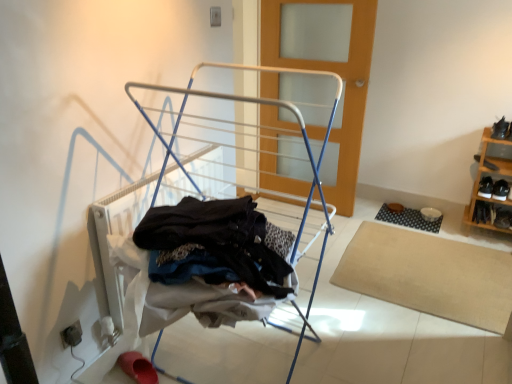
The width and height of the screenshot is (512, 384). Describe the element at coordinates (327, 70) in the screenshot. I see `wooden door at center` at that location.

What is the approximate height of wooden door at center?

It is 1.45 meters.

The height and width of the screenshot is (384, 512). In order to click on black leather shoe at lower right, positioned as the 1th shoe in bottom-to-top order in this screenshot , I will do `click(503, 219)`.

At what (x,y) coordinates should I click in order to perform the action: click on black leather shoe at right, arranged as the second shoe when viewed from the top. Please return your answer as a coordinate pair (x, y). This screenshot has height=384, width=512. Looking at the image, I should click on (490, 165).

The width and height of the screenshot is (512, 384). What do you see at coordinates (490, 165) in the screenshot?
I see `black leather shoe at right, acting as the fourth shoe starting from the bottom` at bounding box center [490, 165].

The height and width of the screenshot is (384, 512). What do you see at coordinates (138, 367) in the screenshot?
I see `rubber shoe at lower left, the first footwear positioned from the front` at bounding box center [138, 367].

Find the location of a particular element. The image size is (512, 384). wooden door at center is located at coordinates (327, 70).

Can you confirm if wooden shoe rack at right is shorter than black leather shoe at lower right, the 5th shoe in the top-to-bottom sequence?

Incorrect, the height of wooden shoe rack at right does not fall short of that of black leather shoe at lower right, the 5th shoe in the top-to-bottom sequence.

Where is `furniture above the black leather shoe at lower right, positioned as the 1th shoe in bottom-to-top order (from the image's perspective)`? Image resolution: width=512 pixels, height=384 pixels. furniture above the black leather shoe at lower right, positioned as the 1th shoe in bottom-to-top order (from the image's perspective) is located at coordinates (490, 175).

Is wooden shoe rack at right far from black leather shoe at lower right, the 5th shoe in the top-to-bottom sequence?

No, wooden shoe rack at right is not far away from black leather shoe at lower right, the 5th shoe in the top-to-bottom sequence.

From the image's perspective, is wooden shoe rack at right below black leather shoe at lower right, the 5th shoe in the top-to-bottom sequence?

Actually, wooden shoe rack at right appears above black leather shoe at lower right, the 5th shoe in the top-to-bottom sequence, in the image.

Which of these two, rubber shoe at lower left, which is the second footwear from right to left, or white metal drying rack at center, is smaller?

rubber shoe at lower left, which is the second footwear from right to left.

Which of these two, rubber shoe at lower left, the second footwear positioned from the back, or white metal drying rack at center, is wider?

With larger width is white metal drying rack at center.

Are rubber shoe at lower left, the first footwear positioned from the front, and white metal drying rack at center beside each other?

No, rubber shoe at lower left, the first footwear positioned from the front, is not in contact with white metal drying rack at center.

Is rubber shoe at lower left, arranged as the 1th footwear when ordered from the bottom, turned away from white metal drying rack at center?

Absolutely, rubber shoe at lower left, arranged as the 1th footwear when ordered from the bottom, is directed away from white metal drying rack at center.

This screenshot has height=384, width=512. Identify the location of mat behind the black leather shoes at lower right, which is counted as the 1th footwear, starting from the top. (408, 219).

Is black leather shoes at lower right, the 1th footwear positioned from the back, spatially inside black rubber mat at lower right, which ranks as the second mat in front-to-back order, or outside of it?

black leather shoes at lower right, the 1th footwear positioned from the back, is not enclosed by black rubber mat at lower right, which ranks as the second mat in front-to-back order.

Is black leather shoes at lower right, the 1th footwear positioned from the back, smaller than black rubber mat at lower right, which is counted as the 1th mat, starting from the back?

No, black leather shoes at lower right, the 1th footwear positioned from the back, is not smaller than black rubber mat at lower right, which is counted as the 1th mat, starting from the back.

Can you tell me how much black leather shoes at lower right, the 2th footwear in the front-to-back sequence, and black rubber mat at lower right, which ranks as the second mat in front-to-back order, differ in facing direction?

The angular difference between black leather shoes at lower right, the 2th footwear in the front-to-back sequence, and black rubber mat at lower right, which ranks as the second mat in front-to-back order, is 1.15 degrees.

Can you confirm if rubber shoe at lower left, placed as the second footwear when sorted from top to bottom, is positioned to the right of black leather shoe at upper right, positioned as the fifth shoe in bottom-to-top order?

Incorrect, rubber shoe at lower left, placed as the second footwear when sorted from top to bottom, is not on the right side of black leather shoe at upper right, positioned as the fifth shoe in bottom-to-top order.

Consider the image. Is black leather shoe at upper right, positioned as the fifth shoe in bottom-to-top order, surrounded by rubber shoe at lower left, the first footwear positioned from the front?

No, black leather shoe at upper right, positioned as the fifth shoe in bottom-to-top order, is located outside of rubber shoe at lower left, the first footwear positioned from the front.

Considering the relative sizes of rubber shoe at lower left, placed as the second footwear when sorted from top to bottom, and black leather shoe at upper right, positioned as the fifth shoe in bottom-to-top order, in the image provided, is rubber shoe at lower left, placed as the second footwear when sorted from top to bottom, bigger than black leather shoe at upper right, positioned as the fifth shoe in bottom-to-top order,?

No, rubber shoe at lower left, placed as the second footwear when sorted from top to bottom, is not bigger than black leather shoe at upper right, positioned as the fifth shoe in bottom-to-top order.

The height and width of the screenshot is (384, 512). Find the location of `footwear that is the 2nd object located below the black leather shoe at upper right, arranged as the first shoe when viewed from the top (from the image's perspective)`. footwear that is the 2nd object located below the black leather shoe at upper right, arranged as the first shoe when viewed from the top (from the image's perspective) is located at coordinates (138, 367).

Can you confirm if beige carpet at lower right, which appears as the 2th mat when viewed from the back, is wider than white metal drying rack at center?

Correct, the width of beige carpet at lower right, which appears as the 2th mat when viewed from the back, exceeds that of white metal drying rack at center.

Who is bigger, beige carpet at lower right, arranged as the second mat when viewed from the top, or white metal drying rack at center?

With larger size is white metal drying rack at center.

How many degrees apart are the facing directions of beige carpet at lower right, the first mat from the front, and white metal drying rack at center?

The angular difference between beige carpet at lower right, the first mat from the front, and white metal drying rack at center is 89.1 degrees.

Visually, is beige carpet at lower right, which appears as the 2th mat when viewed from the back, positioned to the left or to the right of white metal drying rack at center?

In the image, beige carpet at lower right, which appears as the 2th mat when viewed from the back, appears on the right side of white metal drying rack at center.

Would you say wooden shoe rack at right is a long distance from black rubber mat at lower right, which ranks as the second mat in front-to-back order?

They are positioned close to each other.

Does wooden shoe rack at right have a larger size compared to black rubber mat at lower right, which ranks as the second mat in front-to-back order?

Correct, wooden shoe rack at right is larger in size than black rubber mat at lower right, which ranks as the second mat in front-to-back order.

Which is more to the right, wooden shoe rack at right or black rubber mat at lower right, which is counted as the 1th mat, starting from the back?

From the viewer's perspective, wooden shoe rack at right appears more on the right side.

Is point (499, 144) closer or farther from the camera than point (381, 207)?

Point (499, 144).

Which is more to the right, black leather shoe at lower right, placed as the second shoe when sorted from bottom to top, or black leather shoe at right, arranged as the second shoe when viewed from the top?

black leather shoe at lower right, placed as the second shoe when sorted from bottom to top.

Based on the photo, from a real-world perspective, is black leather shoe at lower right, placed as the second shoe when sorted from bottom to top, physically above black leather shoe at right, acting as the fourth shoe starting from the bottom?

Incorrect, from a real-world perspective, black leather shoe at lower right, placed as the second shoe when sorted from bottom to top, is lower than black leather shoe at right, acting as the fourth shoe starting from the bottom.

Does black leather shoe at lower right, placed as the second shoe when sorted from bottom to top, have a lesser height compared to black leather shoe at right, arranged as the second shoe when viewed from the top?

In fact, black leather shoe at lower right, placed as the second shoe when sorted from bottom to top, may be taller than black leather shoe at right, arranged as the second shoe when viewed from the top.

Is black leather shoe at lower right, placed as the second shoe when sorted from bottom to top, in front of or behind black leather shoe at right, acting as the fourth shoe starting from the bottom, in the image?

black leather shoe at lower right, placed as the second shoe when sorted from bottom to top, is behind black leather shoe at right, acting as the fourth shoe starting from the bottom.

Identify the location of furniture above the black leather shoe at lower right, positioned as the 1th shoe in bottom-to-top order (from a real-world perspective). (490, 175).

Locate an element on the screen. This screenshot has width=512, height=384. footwear that is the 2nd one below the white metal drying rack at center (from a real-world perspective) is located at coordinates (138, 367).

Estimate the real-world distances between objects in this image. Which object is further from black leather shoe at lower right, placed as the second shoe when sorted from bottom to top, black leather shoe at upper right, positioned as the fifth shoe in bottom-to-top order, or white metal drying rack at center?

The object further to black leather shoe at lower right, placed as the second shoe when sorted from bottom to top, is white metal drying rack at center.

Looking at the image, which one is located further to white metal drying rack at center, black leather shoes at lower right, placed as the second footwear when sorted from left to right, or black leather shoe at upper right, arranged as the first shoe when viewed from the top?

black leather shoe at upper right, arranged as the first shoe when viewed from the top, lies further to white metal drying rack at center than the other object.

Considering their positions, is black leather shoe at lower right, the 5th shoe in the top-to-bottom sequence, positioned closer to black leather shoes at lower right, the 2th footwear in the front-to-back sequence, than black leather shoe at lower right, which ranks as the 3th shoe in bottom-to-top order?

black leather shoe at lower right, which ranks as the 3th shoe in bottom-to-top order.

Based on their spatial positions, is black leather shoes at lower right, the 1th footwear positioned from the back, or black leather shoe at lower right, placed as the second shoe when sorted from bottom to top, further from rubber shoe at lower left, marked as the first footwear in a left-to-right arrangement?

black leather shoe at lower right, placed as the second shoe when sorted from bottom to top.

Which object lies further to the anchor point black rubber mat at lower right, the first mat when ordered from top to bottom, black leather shoe at right, arranged as the second shoe when viewed from the top, or wooden door at center?

wooden door at center is positioned further to the anchor black rubber mat at lower right, the first mat when ordered from top to bottom.

From the image, which object appears to be farther from black leather shoe at lower right, placed as the 4th shoe when sorted from top to bottom, black leather shoe at right, acting as the fourth shoe starting from the bottom, or black leather shoes at lower right, which is counted as the first footwear, starting from the right?

Among the two, black leather shoe at right, acting as the fourth shoe starting from the bottom, is located further to black leather shoe at lower right, placed as the 4th shoe when sorted from top to bottom.

Estimate the real-world distances between objects in this image. Which object is further from black leather shoes at lower right, which is counted as the 1th footwear, starting from the top, black leather shoe at right, acting as the fourth shoe starting from the bottom, or black rubber mat at lower right, which ranks as the second mat in front-to-back order?

black rubber mat at lower right, which ranks as the second mat in front-to-back order.

Consider the image. From the image, which object appears to be nearer to black leather shoes at lower right, the 2th footwear ordered from the bottom, black leather shoe at lower right, which ranks as the 3th shoe in bottom-to-top order, or rubber shoe at lower left, which is the second footwear from right to left?

black leather shoe at lower right, which ranks as the 3th shoe in bottom-to-top order, lies closer to black leather shoes at lower right, the 2th footwear ordered from the bottom, than the other object.

Locate an element on the screen. Image resolution: width=512 pixels, height=384 pixels. shoe between black leather shoes at lower right, the 2th footwear in the front-to-back sequence, and black leather shoe at lower right, placed as the 4th shoe when sorted from top to bottom, in the up-down direction is located at coordinates (478, 212).

Locate an element on the screen. furniture between black leather shoe at upper right, positioned as the fifth shoe in bottom-to-top order, and black leather shoes at lower right, placed as the second footwear when sorted from left to right, in the up-down direction is located at coordinates (490, 175).

I want to click on furniture located between white metal drying rack at center and black leather shoe at lower right, the 5th shoe in the top-to-bottom sequence, in the left-right direction, so point(490,175).

Find the location of a particular element. The height and width of the screenshot is (384, 512). mat positioned between white metal drying rack at center and black leather shoe at lower right, which ranks as the 3th shoe in top-to-bottom order, from near to far is located at coordinates (430, 275).